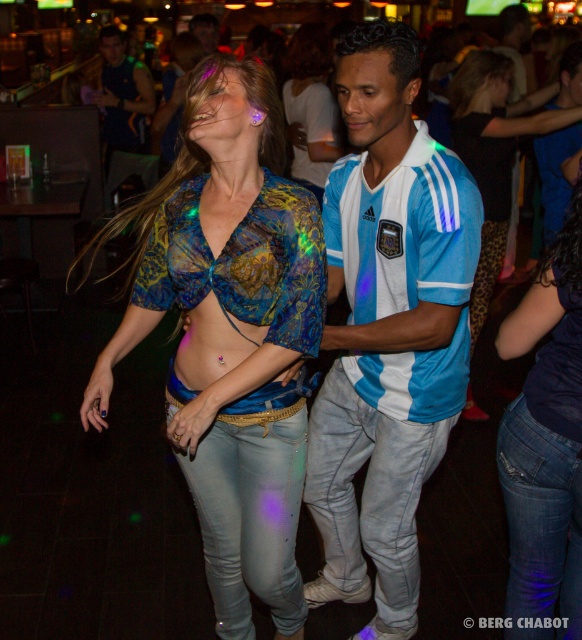
You are a fashion designer observing the woman in the image. You notice the shiny blue fabric top at center and the denim jeans at center. Which piece of clothing is taller?

The shiny blue fabric top at center is taller than the denim jeans at center.

You are a photographer at the dance club and need to capture a photo of both denim jeans at lower right and denim jeans at center without any obstruction. Given that your camera has a 1.5 meter focal length, can you position yourself close enough to ensure both are in frame?

The denim jeans at lower right is 1.65 meters away from denim jeans at center. Since the distance between them exceeds the camera focal length of 1.5 meters, you might need to position yourself further back to ensure both are within the frame.

You are a photographer positioned at the front of the dance club. You want to capture a closeup shot of the shiny blue fabric top at center without including the people behind it. The camera has a depth of field that can focus on objects within 1.5 meters. Is this possible?

The shiny blue fabric top at center is 1.66 meters from the viewer, which is beyond the camera lens depth of field of 1.5 meters. Therefore, the photographer cannot capture a closeup shot of the shiny blue fabric top at center without including the people behind it.